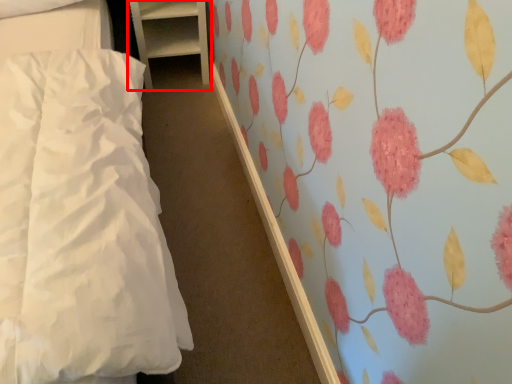
Question: Considering the relative positions of furniture (annotated by the red box) and bed in the image provided, where is furniture (annotated by the red box) located with respect to the staircase?

Choices:
 (A) left
 (B) right

Answer: (B)